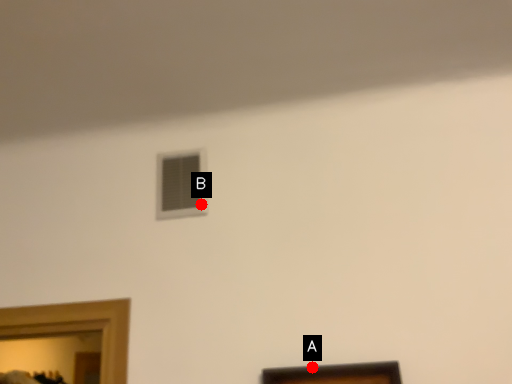
Question: Two points are circled on the image, labeled by A and B beside each circle. Which point is further to the camera?

Choices:
 (A) A is further
 (B) B is further

Answer: (B)